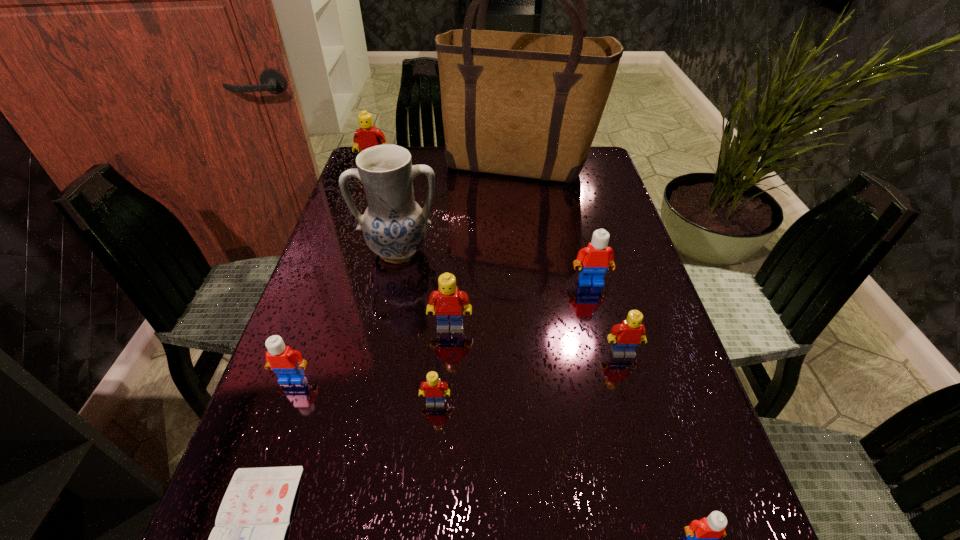
You are a GUI agent. You are given a task and a screenshot of the screen. Output one action in this format:
    pyautogui.click(x=<x>, y=<y>)
    Task: Click on the tallest object
    This screenshot has width=960, height=540.
    Given the screenshot: What is the action you would take?
    pyautogui.click(x=521, y=104)

Find the location of a particular element. the third farthest object is located at coordinates (394, 226).

Image resolution: width=960 pixels, height=540 pixels. Identify the location of blue pottery. (394, 226).

Find the location of a particular element. This screenshot has height=540, width=960. the leftmost yellow Lego is located at coordinates (367, 136).

Image resolution: width=960 pixels, height=540 pixels. In order to click on the tallest Lego in this screenshot , I will do `click(367, 136)`.

Where is `the third nearest yellow Lego`? The width and height of the screenshot is (960, 540). the third nearest yellow Lego is located at coordinates (448, 303).

The image size is (960, 540). Find the location of `the sixth nearest object`. the sixth nearest object is located at coordinates (448, 303).

This screenshot has height=540, width=960. I want to click on the seventh nearest object, so click(597, 256).

In order to click on the second farthest Lego in this screenshot , I will do `click(597, 256)`.

In order to click on the fifth farthest Lego in this screenshot , I will do coord(286,363).